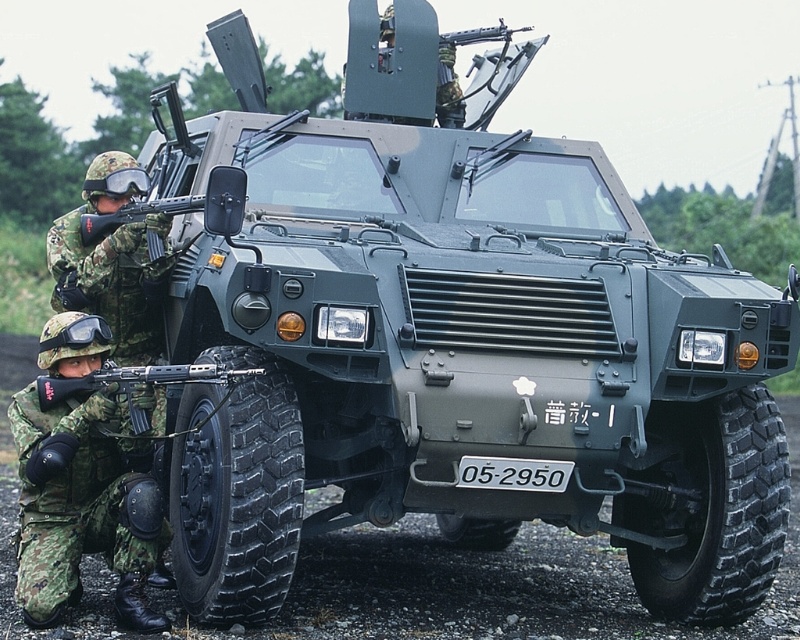
You are a military analyst assessing the scene. You need to determine if the black matte rifle at lower left is within a 6 meter safety zone. Can you confirm?

The black matte rifle at lower left is 5.59 meters away from the camera, so it is within the 6 meter safety zone.

You are a military engineer tasked with securing the area. You need to place a 6 feet long barrier between the black matte rifle at lower left and the white plastic license plate at center. Is this possible?

The distance between the black matte rifle at lower left and the white plastic license plate at center is 5.13 feet. Since the barrier is 6 feet long, which is longer than the distance between them, it is not possible to place the barrier between them.

You are a photographer trying to capture a clear photo of the white plastic license plate at center and the black matte rifle at lower left. Which object should you focus on first if you want to ensure both are in focus without adjusting the camera settings?

The black matte rifle at lower left is closer to the viewer than the white plastic license plate at center. To ensure both are in focus, you should focus on the black matte rifle at lower left first since it is closer, and the depth of field may extend to the license plate if positioned correctly.